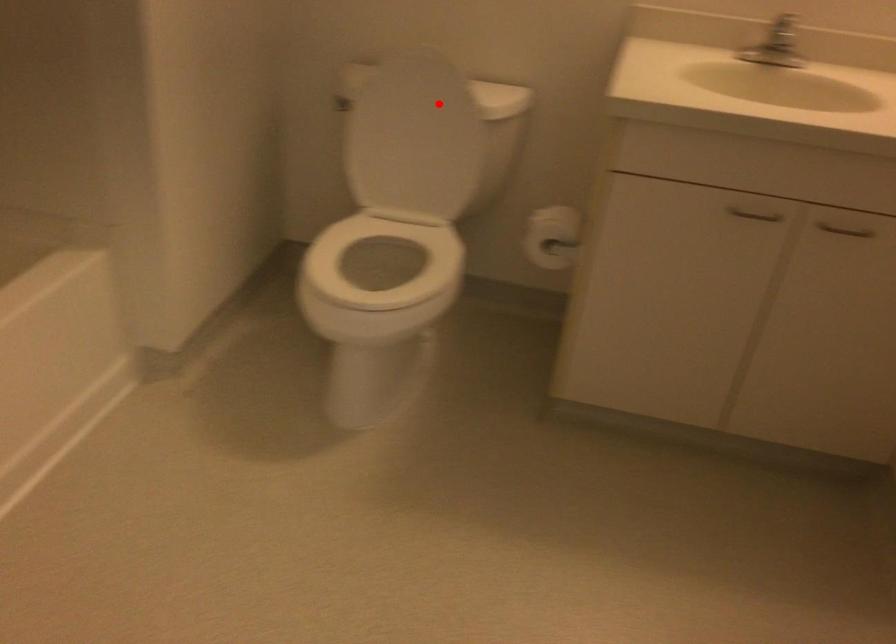
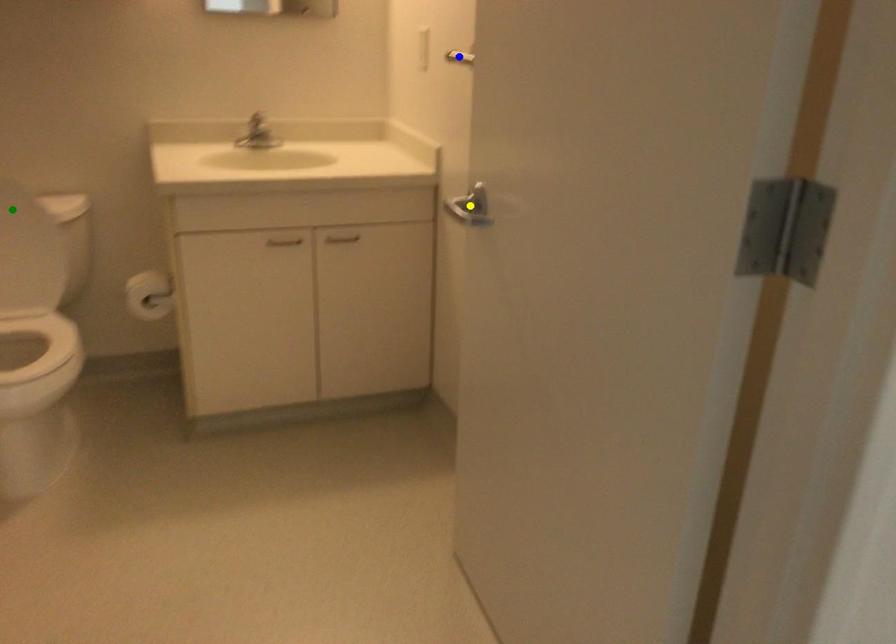
Question: I am providing you with two images of the same scene from different viewpoints. A red point is marked on the first image. You are given multiple points on the second image. In image 2, which mark is for the same physical point as the one in image 1?

Choices:
 (A) yellow point
 (B) blue point
 (C) green point

Answer: (C)